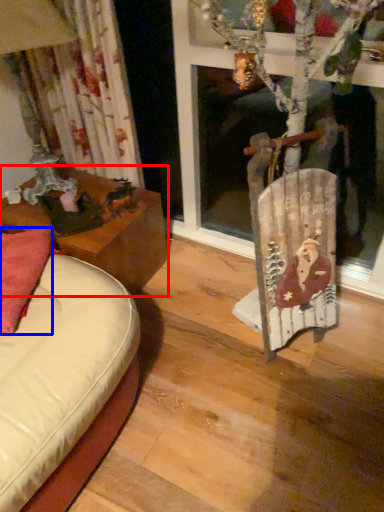
Question: Among these objects, which one is nearest to the camera, table (highlighted by a red box) or pillow (highlighted by a blue box)?

Choices:
 (A) table
 (B) pillow

Answer: (B)